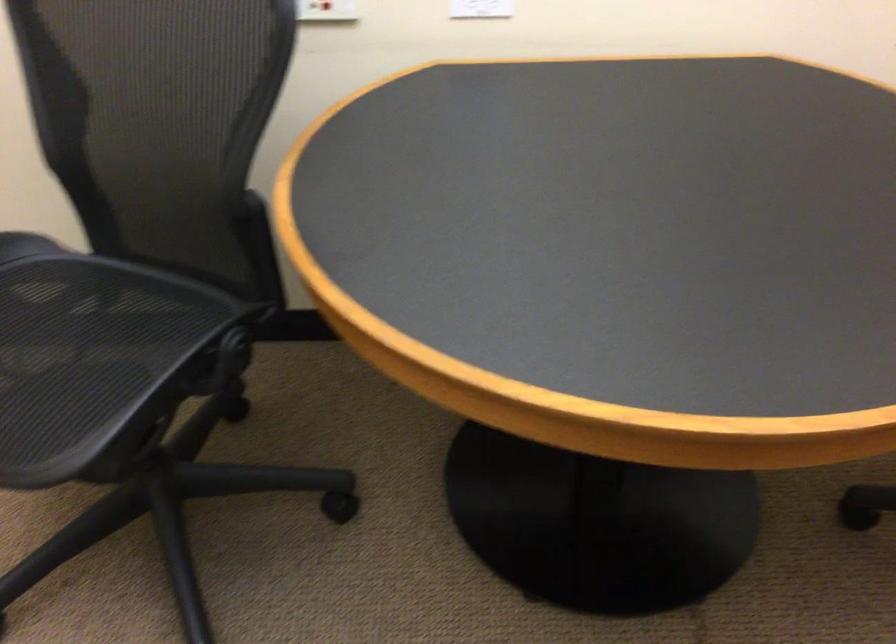
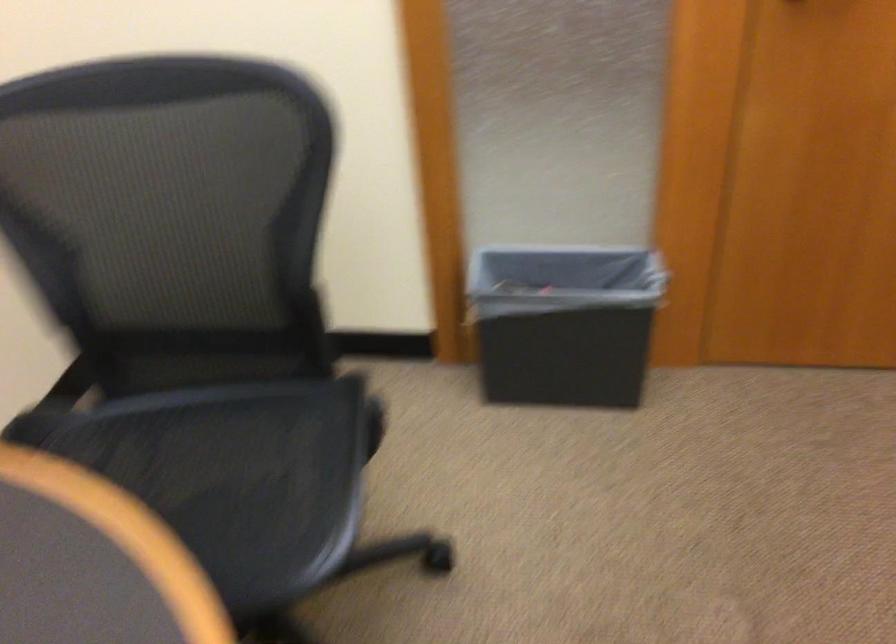
First-person continuous shooting, in which direction is the camera rotating?

The camera rotated toward right-down.